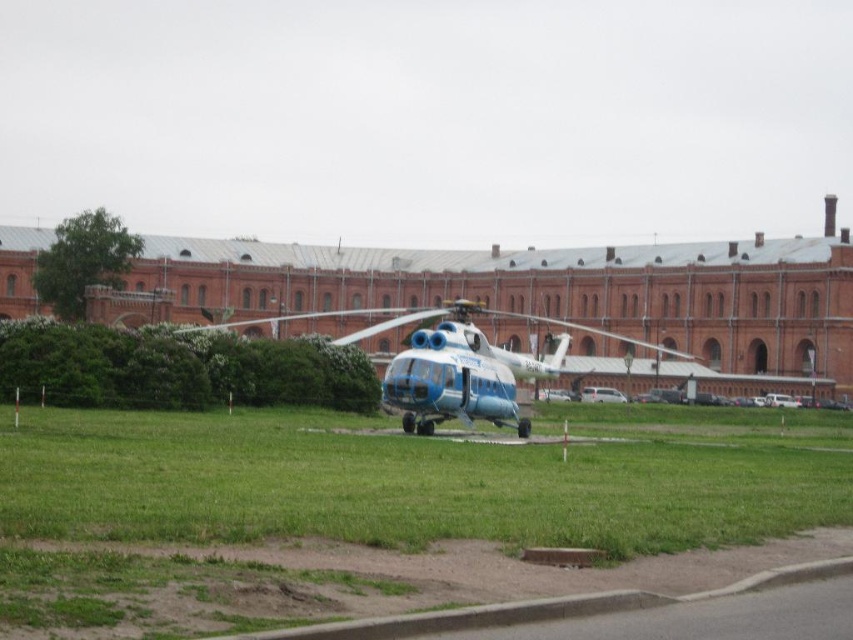
You are standing at the origin point of the coordinate system. You want to walk to the green grass at center. Which direction should you move in?

Since the green grass at center is located at coordinate point (397, 483), you should move towards the right and slightly forward to reach it.

You are standing at the point marked by the coordinates point (x=397, y=483) in the image. What is the color of the ground beneath your feet?

The point (x=397, y=483) indicates green grass at center, so the ground beneath your feet is green grass.

Consider the image. You are a drone operator planning to fly a drone from the green grass at center to the blue metallic helicopter at center. The drone has a maximum flight range of 50 feet. Based on the scene, can the drone reach the helicopter?

The distance between the green grass at center and the blue metallic helicopter at center is 55.65 feet, which exceeds the drone operator drone has a maximum flight range of 50 feet. Therefore, the drone cannot reach the helicopter.